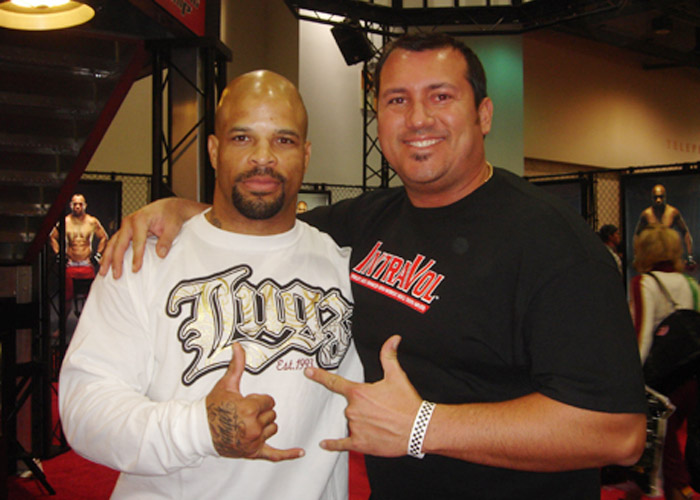
Where is `poster`? The width and height of the screenshot is (700, 500). poster is located at coordinates (682, 184), (102, 200).